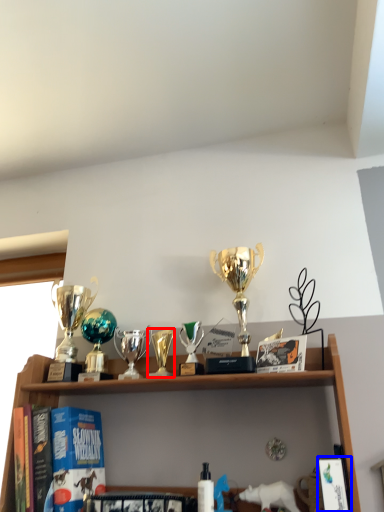
Question: Which of the following is the closest to the observer, candle holder (highlighted by a red box) or book (highlighted by a blue box)?

Choices:
 (A) candle holder
 (B) book

Answer: (B)